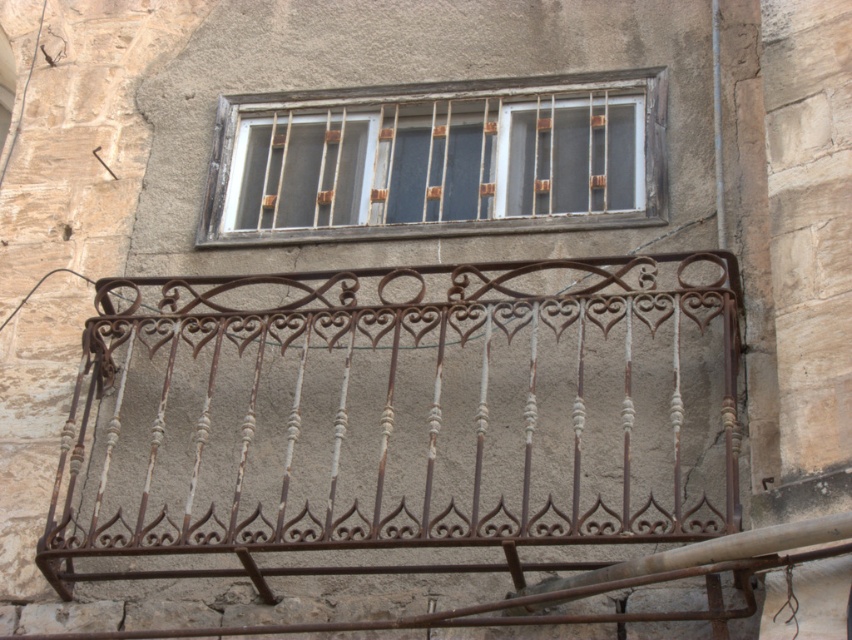
Question: Can you confirm if rusty wrought iron balcony at center is positioned to the right of wooden bars at upper center?

Choices:
 (A) no
 (B) yes

Answer: (A)

Question: Where is rusty wrought iron balcony at center located in relation to wooden bars at upper center in the image?

Choices:
 (A) right
 (B) left

Answer: (B)

Question: Which point is closer to the camera?

Choices:
 (A) (249, 99)
 (B) (561, 342)

Answer: (B)

Question: Is rusty wrought iron balcony at center wider than wooden bars at upper center?

Choices:
 (A) no
 (B) yes

Answer: (B)